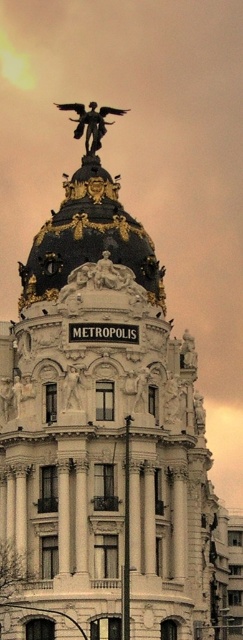
Question: From the image, what is the correct spatial relationship of bronze/golden statue at top center in relation to white marble statue at center?

Choices:
 (A) left
 (B) right

Answer: (B)

Question: Does bronze/golden statue at top center appear on the right side of white marble statue at center?

Choices:
 (A) yes
 (B) no

Answer: (A)

Question: Can you confirm if bronze/golden statue at top center is positioned above white marble statue at center?

Choices:
 (A) yes
 (B) no

Answer: (A)